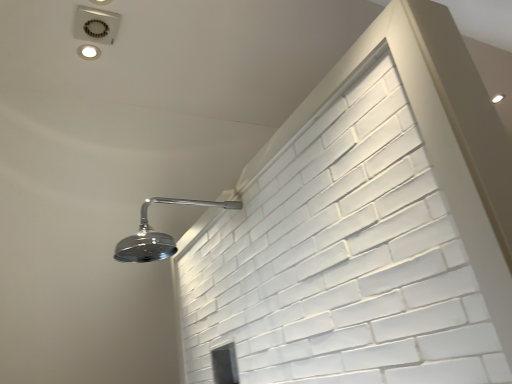
Question: Is matte white droplight at upper left, positioned as the 1th droplight in front-to-back order, beside chrome metallic shower head at upper left?

Choices:
 (A) no
 (B) yes

Answer: (A)

Question: Is matte white droplight at upper left, the 1th droplight when ordered from left to right, facing towards chrome metallic shower head at upper left?

Choices:
 (A) no
 (B) yes

Answer: (A)

Question: Is matte white droplight at upper left, placed as the second droplight when sorted from right to left, located outside chrome metallic shower head at upper left?

Choices:
 (A) yes
 (B) no

Answer: (A)

Question: From the image's perspective, would you say matte white droplight at upper left, the 1th droplight when ordered from left to right, is positioned over chrome metallic shower head at upper left?

Choices:
 (A) yes
 (B) no

Answer: (A)

Question: From a real-world perspective, does matte white droplight at upper left, which ranks as the second droplight in back-to-front order, sit lower than chrome metallic shower head at upper left?

Choices:
 (A) no
 (B) yes

Answer: (A)

Question: Is matte white droplight at upper left, which ranks as the second droplight in back-to-front order, thinner than chrome metallic shower head at upper left?

Choices:
 (A) yes
 (B) no

Answer: (A)

Question: Is matte silver droplight at upper right, positioned as the second droplight in left-to-right order, surrounding chrome metallic shower head at upper left?

Choices:
 (A) yes
 (B) no

Answer: (B)

Question: Considering the relative positions of matte silver droplight at upper right, marked as the 2th droplight in a front-to-back arrangement, and chrome metallic shower head at upper left in the image provided, is matte silver droplight at upper right, marked as the 2th droplight in a front-to-back arrangement, in front of chrome metallic shower head at upper left?

Choices:
 (A) yes
 (B) no

Answer: (B)

Question: From a real-world perspective, is matte silver droplight at upper right, marked as the 2th droplight in a front-to-back arrangement, physically above chrome metallic shower head at upper left?

Choices:
 (A) yes
 (B) no

Answer: (A)

Question: Is matte silver droplight at upper right, positioned as the second droplight in left-to-right order, positioned with its back to chrome metallic shower head at upper left?

Choices:
 (A) no
 (B) yes

Answer: (A)

Question: From the image's perspective, is matte silver droplight at upper right, positioned as the second droplight in left-to-right order, located beneath chrome metallic shower head at upper left?

Choices:
 (A) yes
 (B) no

Answer: (B)

Question: Does matte silver droplight at upper right, which is the first droplight from right to left, turn towards chrome metallic shower head at upper left?

Choices:
 (A) no
 (B) yes

Answer: (A)

Question: Does matte white droplight at upper left, placed as the second droplight when sorted from right to left, have a lesser height compared to matte silver droplight at upper right, marked as the 2th droplight in a front-to-back arrangement?

Choices:
 (A) no
 (B) yes

Answer: (A)